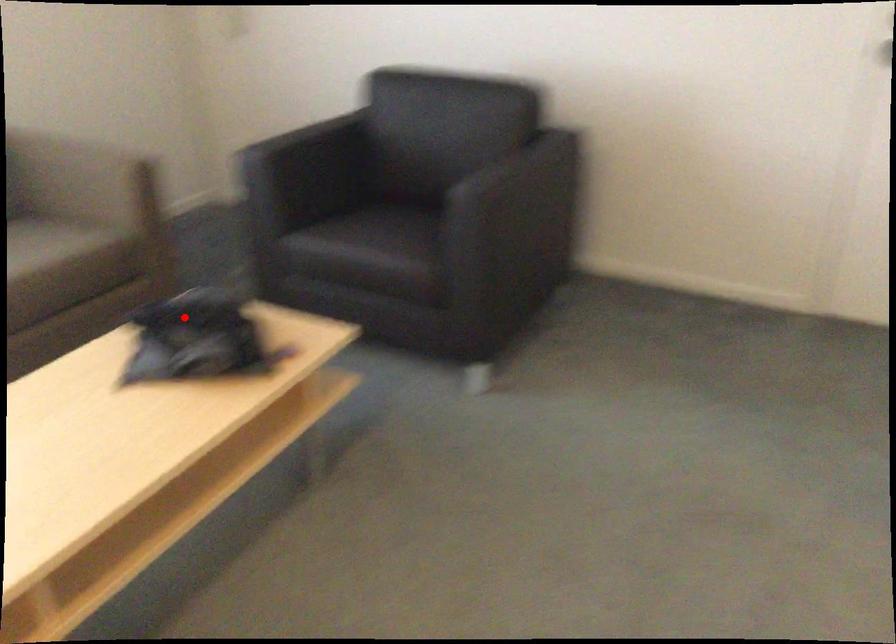
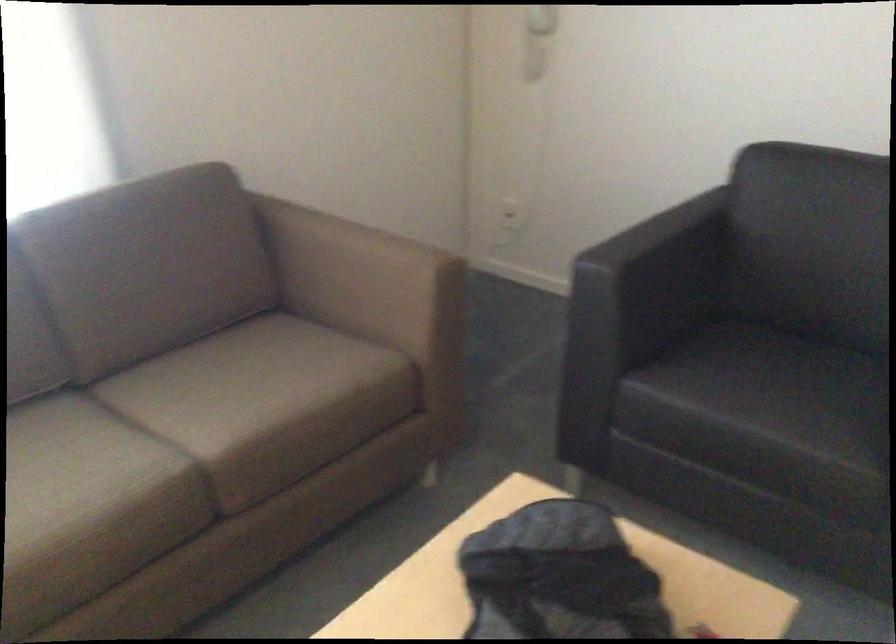
In the second image, find the point that corresponds to the highlighted location in the first image.

(558, 576)